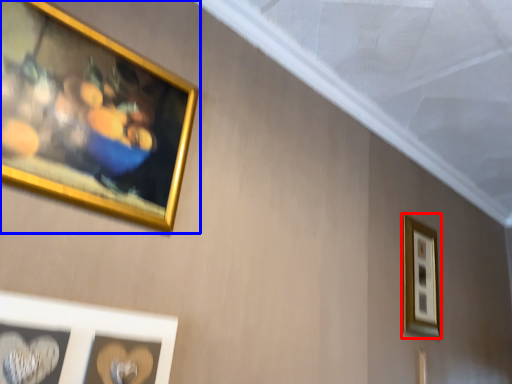
Question: Which of the following is the farthest to the observer, picture frame (highlighted by a red box) or picture frame (highlighted by a blue box)?

Choices:
 (A) picture frame
 (B) picture frame

Answer: (A)